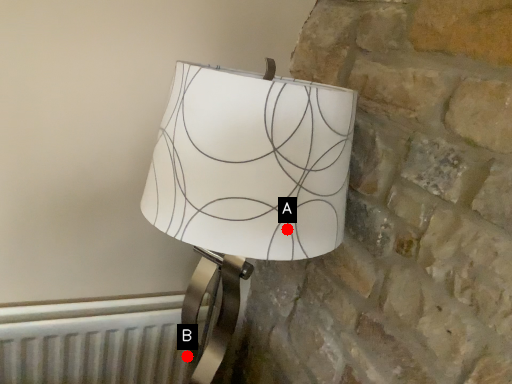
Question: Two points are circled on the image, labeled by A and B beside each circle. Which point appears farthest from the camera in this image?

Choices:
 (A) A is further
 (B) B is further

Answer: (B)